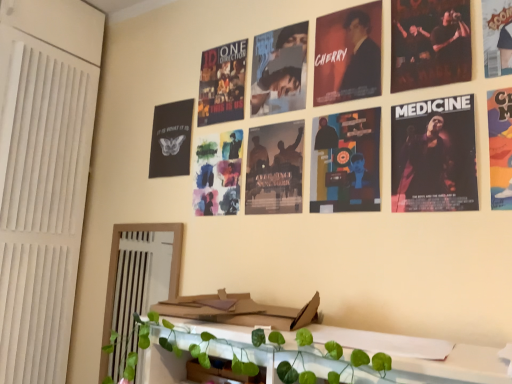
Question: Should I look upward or downward to see matte paper poster at center, which ranks as the 6th poster in right-to-left order?

Choices:
 (A) down
 (B) up

Answer: (B)

Question: Does cardboard magazine at center come in front of matte paper poster at center, which ranks as the 6th poster in right-to-left order?

Choices:
 (A) yes
 (B) no

Answer: (A)

Question: From the image's perspective, is cardboard magazine at center located above matte paper poster at center, acting as the first poster starting from the left?

Choices:
 (A) yes
 (B) no

Answer: (B)

Question: Is cardboard magazine at center at the left side of matte paper poster at center, which ranks as the 6th poster in right-to-left order?

Choices:
 (A) no
 (B) yes

Answer: (B)

Question: Is the position of cardboard magazine at center more distant than that of matte paper poster at center, acting as the first poster starting from the left?

Choices:
 (A) yes
 (B) no

Answer: (B)

Question: Is cardboard magazine at center wider than matte paper poster at center, which ranks as the 6th poster in right-to-left order?

Choices:
 (A) no
 (B) yes

Answer: (B)

Question: From the image's perspective, is cardboard magazine at center located beneath matte paper poster at center, which ranks as the 6th poster in right-to-left order?

Choices:
 (A) no
 (B) yes

Answer: (B)

Question: Does cartoon character poster at upper right, which ranks as the first poster in right-to-left order, have a lesser height compared to dark matte poster at upper center, the fourth poster from the right?

Choices:
 (A) no
 (B) yes

Answer: (B)

Question: Is cartoon character poster at upper right, which ranks as the first poster in right-to-left order, outside of dark matte poster at upper center, the fourth poster from the right?

Choices:
 (A) no
 (B) yes

Answer: (B)

Question: Does cartoon character poster at upper right, positioned as the sixth poster in left-to-right order, have a larger size compared to dark matte poster at upper center, the 3th poster in the left-to-right sequence?

Choices:
 (A) yes
 (B) no

Answer: (B)

Question: Can you confirm if cartoon character poster at upper right, which ranks as the first poster in right-to-left order, is positioned to the left of dark matte poster at upper center, the 3th poster in the left-to-right sequence?

Choices:
 (A) no
 (B) yes

Answer: (A)

Question: From a real-world perspective, is cartoon character poster at upper right, which ranks as the first poster in right-to-left order, positioned under dark matte poster at upper center, the fourth poster from the right, based on gravity?

Choices:
 (A) yes
 (B) no

Answer: (A)

Question: Is cartoon character poster at upper right, which ranks as the first poster in right-to-left order, touching dark matte poster at upper center, the fourth poster from the right?

Choices:
 (A) yes
 (B) no

Answer: (B)

Question: Is the depth of cartoon character poster at upper right, positioned as the sixth poster in left-to-right order, greater than that of cardboard magazine at center?

Choices:
 (A) yes
 (B) no

Answer: (B)